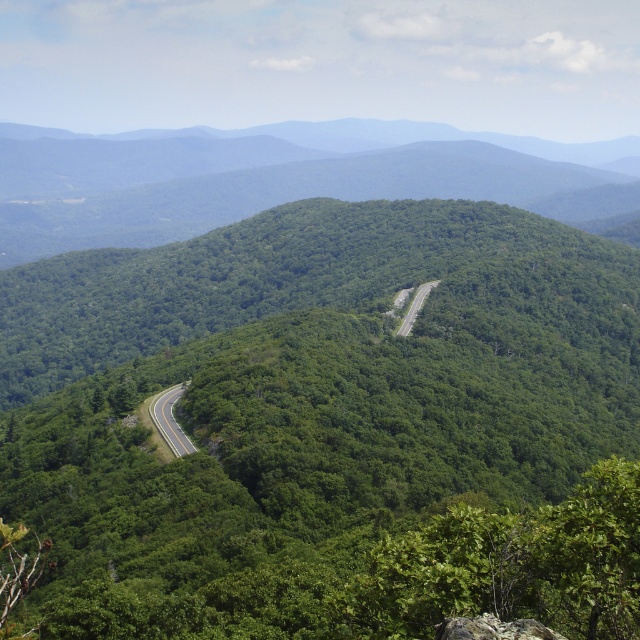
You are a hiker planning to walk along the road in the scenic mountain landscape. You notice two sections of the road labeled as smooth asphalt road at center and green asphalt road at center. Which section of the road is closer to you as you stand at the starting point of your hike?

The smooth asphalt road at center is closer to you because it is in front of the green asphalt road at center.

You are driving a car and see the smooth asphalt road at center and the green asphalt road at center. Which road should you take to stay on the correct path?

You should take the smooth asphalt road at center because it is to the left of the green asphalt road at center, indicating it is the main road.